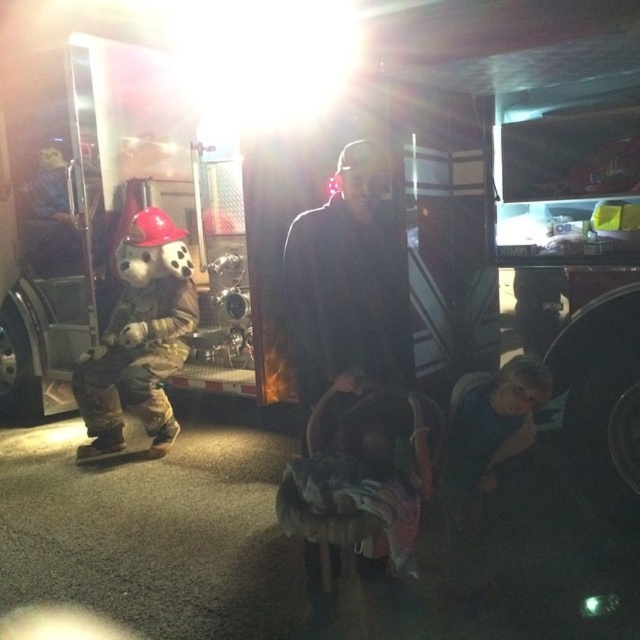
Question: In this image, where is dark fabric baby carriage at center located relative to camouflage fabric costume at left?

Choices:
 (A) above
 (B) below

Answer: (B)

Question: Which object is farther from the camera taking this photo?

Choices:
 (A) dark fabric baby carriage at center
 (B) camouflage fabric costume at left

Answer: (B)

Question: Which object is closer to the camera taking this photo?

Choices:
 (A) camouflage fabric costume at left
 (B) dark blue fabric at center

Answer: (B)

Question: Does dark fabric baby carriage at center appear on the right side of camouflage fabric costume at left?

Choices:
 (A) no
 (B) yes

Answer: (B)

Question: Which of the following is the closest to the observer?

Choices:
 (A) camouflage fabric costume at left
 (B) dark fabric baby carriage at center
 (C) dark blue fabric at center

Answer: (B)

Question: Can you confirm if dark blue fabric at center is positioned to the left of dark fabric baby carriage at center?

Choices:
 (A) no
 (B) yes

Answer: (A)